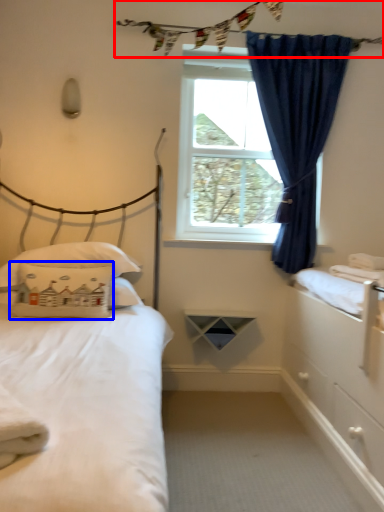
Question: Which object appears farthest to the camera in this image, clothesline (highlighted by a red box) or pillow (highlighted by a blue box)?

Choices:
 (A) clothesline
 (B) pillow

Answer: (A)